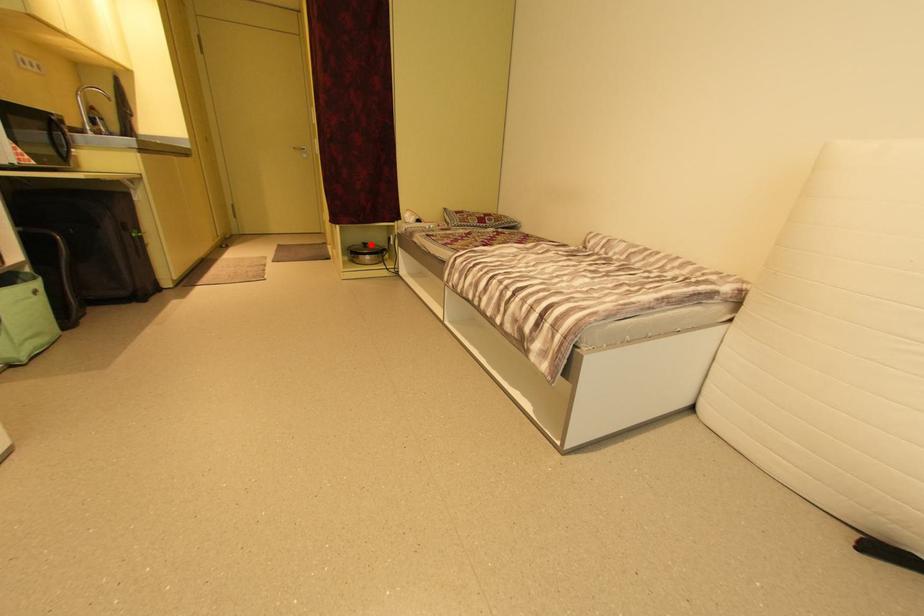
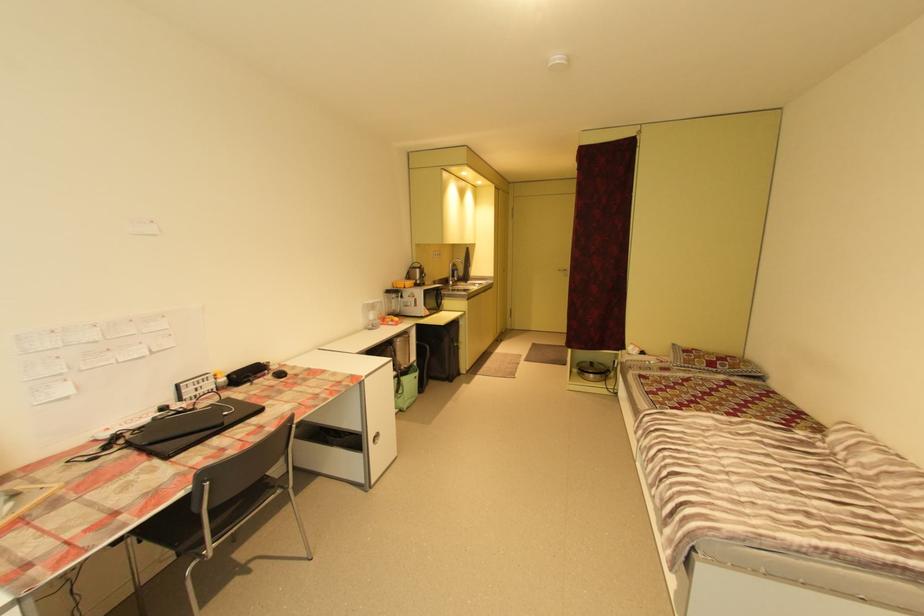
In the second image, find the point that corresponds to the highlighted location in the first image.

(598, 363)